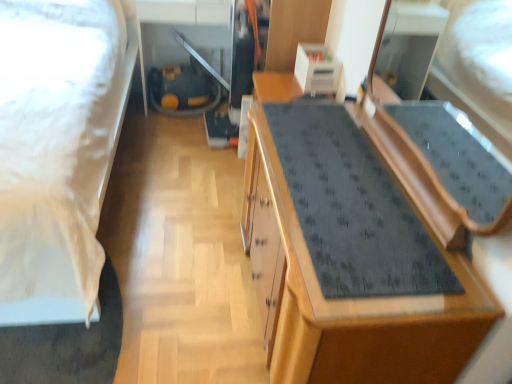
Question: Relative to wooden dresser at center, is white satin bed at left in front or behind?

Choices:
 (A) front
 (B) behind

Answer: (A)

Question: Based on their sizes in the image, would you say white satin bed at left is bigger or smaller than wooden dresser at center?

Choices:
 (A) small
 (B) big

Answer: (B)

Question: Considering the positions of white satin bed at left and wooden dresser at center in the image, is white satin bed at left wider or thinner than wooden dresser at center?

Choices:
 (A) wide
 (B) thin

Answer: (A)

Question: Would you say wooden dresser at center is to the left or to the right of white satin bed at left in the picture?

Choices:
 (A) right
 (B) left

Answer: (A)

Question: From a real-world perspective, relative to white satin bed at left, is wooden dresser at center vertically above or below?

Choices:
 (A) above
 (B) below

Answer: (B)

Question: Considering the positions of point (287, 268) and point (4, 11), is point (287, 268) closer or farther from the camera than point (4, 11)?

Choices:
 (A) closer
 (B) farther

Answer: (A)

Question: Choose the correct answer: Is wooden dresser at center inside white satin bed at left or outside it?

Choices:
 (A) outside
 (B) inside

Answer: (A)